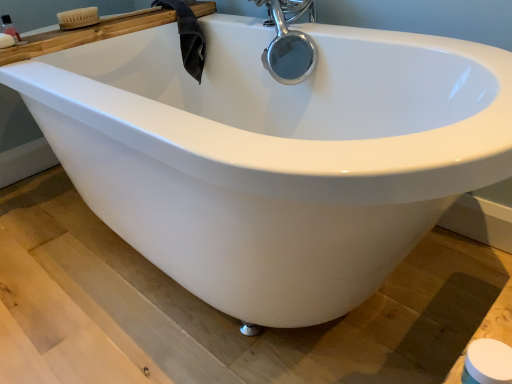
Question: Is point pos(6,44) positioned closer to the camera than point pos(470,365)?

Choices:
 (A) closer
 (B) farther

Answer: (B)

Question: From a real-world perspective, is white matte soap at upper left above or below white matte toilet paper at lower right?

Choices:
 (A) above
 (B) below

Answer: (A)

Question: Estimate the real-world distances between objects in this image. Which object is closer to the woodenbrush at upper left?

Choices:
 (A) translucent plastic bottle at upper left
 (B) white matte toilet paper at lower right
 (C) white matte soap at upper left

Answer: (C)

Question: Based on their relative distances, which object is nearer to the white matte toilet paper at lower right?

Choices:
 (A) white matte soap at upper left
 (B) woodenbrush at upper left
 (C) translucent plastic bottle at upper left

Answer: (B)